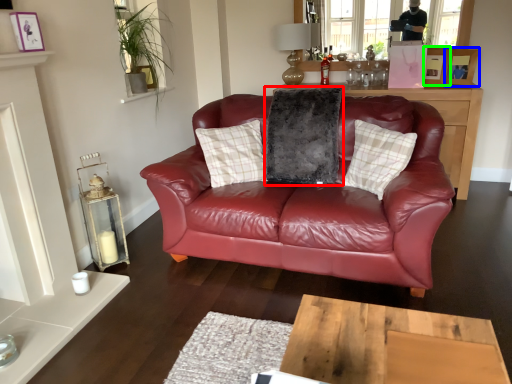
Question: Which object is positioned closest to pillow (highlighted by a red box)? Select from picture frame (highlighted by a blue box) and picture frame (highlighted by a green box).

Choices:
 (A) picture frame
 (B) picture frame

Answer: (B)